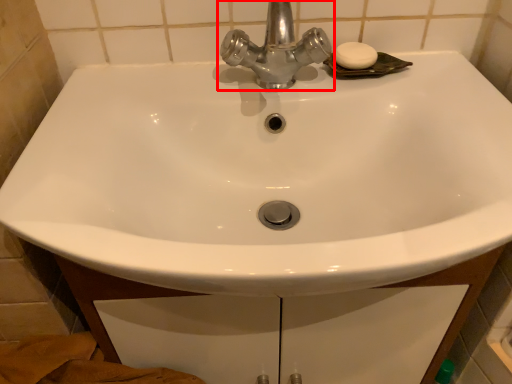
Question: From the image's perspective, where is tap (annotated by the red box) located relative to soap?

Choices:
 (A) below
 (B) above

Answer: (A)